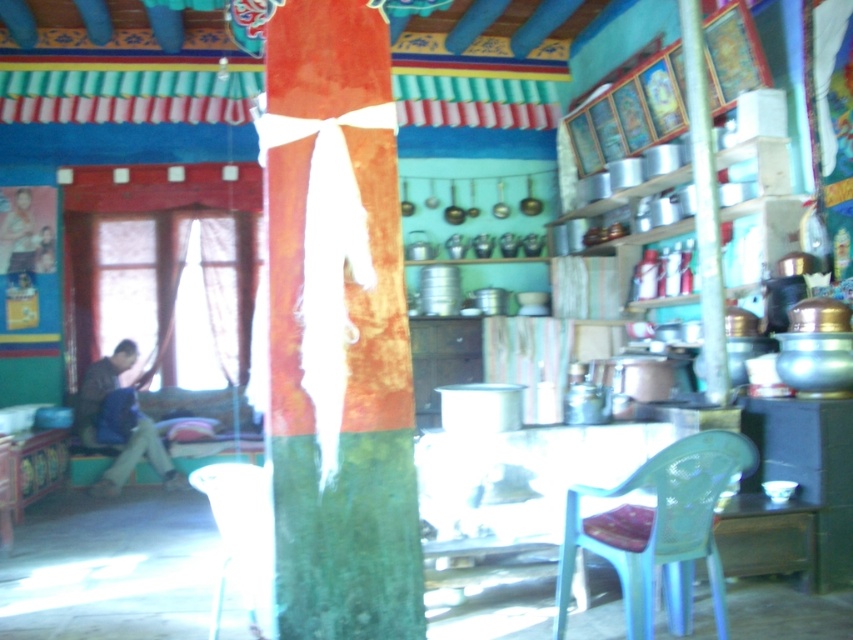
Is green felt tree trunk at center bigger than transparent plastic chair at lower right?

Incorrect, green felt tree trunk at center is not larger than transparent plastic chair at lower right.

Between point (285, 314) and point (691, 536), which one is positioned in front?

Point (285, 314)

Identify the location of green felt tree trunk at center. (346, 344).

Is transparent plastic chair at lower right positioned behind metallic pole at right?

No.

Can you confirm if transparent plastic chair at lower right is wider than metallic pole at right?

Correct, the width of transparent plastic chair at lower right exceeds that of metallic pole at right.

Is point (718, 470) less distant than point (688, 72)?

That is True.

Image resolution: width=853 pixels, height=640 pixels. In order to click on transparent plastic chair at lower right in this screenshot , I will do `click(657, 525)`.

Which is behind, point (706, 401) or point (129, 413)?

Point (129, 413)

What do you see at coordinates (704, 205) in the screenshot? Image resolution: width=853 pixels, height=640 pixels. I see `metallic pole at right` at bounding box center [704, 205].

This screenshot has height=640, width=853. What are the coordinates of `metallic pole at right` in the screenshot? It's located at (704, 205).